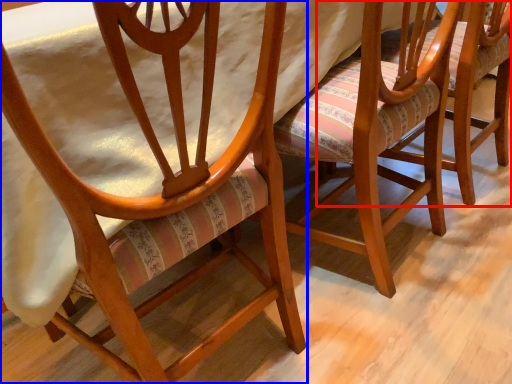
Question: Among these objects, which one is farthest to the camera, chair (highlighted by a red box) or chair (highlighted by a blue box)?

Choices:
 (A) chair
 (B) chair

Answer: (A)